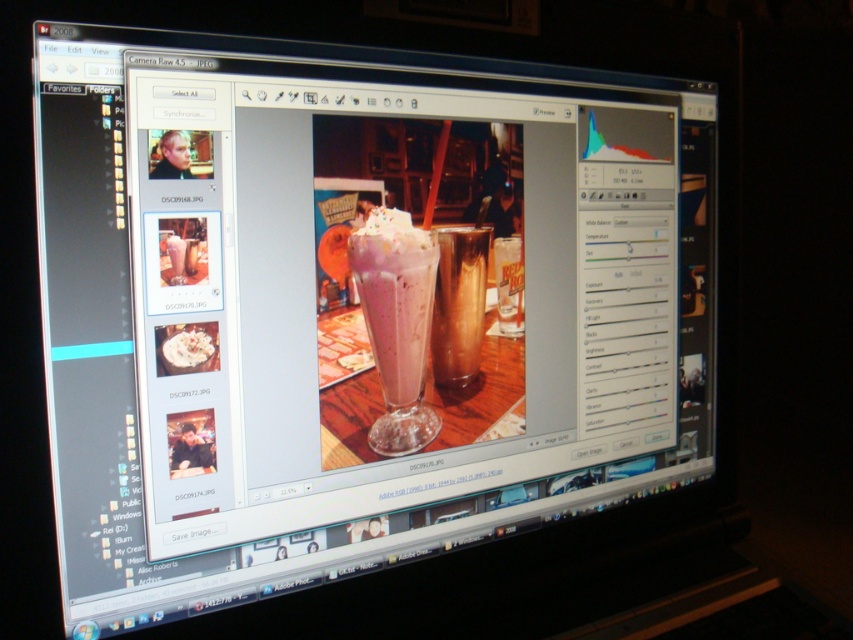
You are a barista who wants to place a small napkin between the pink frosted glass at center and the brown glass at center on the wooden table. The napkin is 1.5 inches wide. Will the napkin fit between them?

The pink frosted glass at center is 1.64 inches from brown glass at center. Since the napkin is 1.5 inches wide, it will fit between them as there is enough space.

You are a barista preparing drinks for customers. You have two glasses in front of you, the pink frosted glass at center and the brown glass at center. A customer orders a large milkshake. Which glass should you use to ensure it fits?

The pink frosted glass at center has a larger size compared to the brown glass at center, so you should use the pink frosted glass at center to ensure the large milkshake fits.